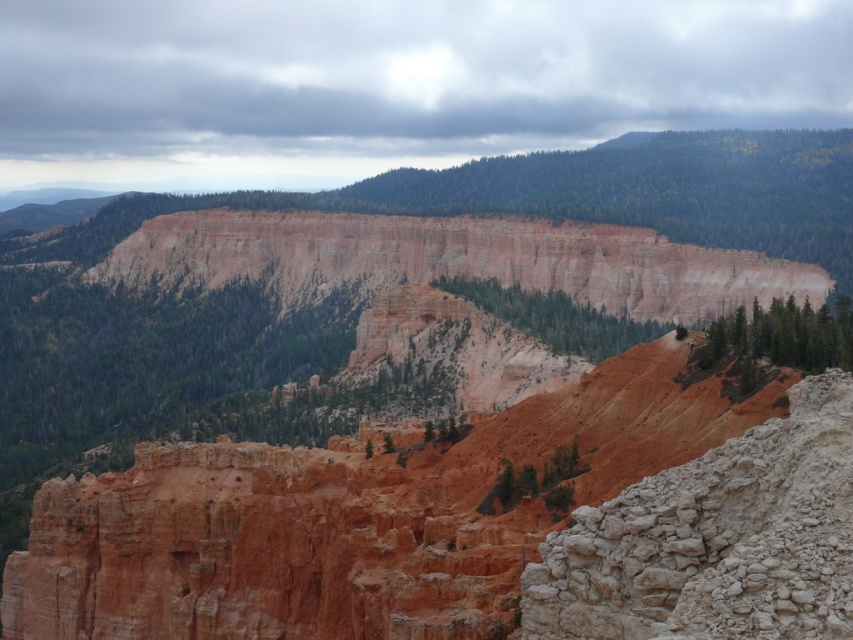
From the picture: Is white rough rock at center right to the right of green textured trees at center from the viewer's perspective?

No, white rough rock at center right is not to the right of green textured trees at center.

Looking at this image, does white rough rock at center right appear over green textured trees at center?

Actually, white rough rock at center right is below green textured trees at center.

Does point (711, 600) come in front of point (576, 301)?

Yes, it is.

The width and height of the screenshot is (853, 640). In order to click on white rough rock at center right in this screenshot , I will do `click(715, 540)`.

Is white rough rock at center right taller than green matte trees at right?

Yes, white rough rock at center right is taller than green matte trees at right.

Is white rough rock at center right to the left of green matte trees at right from the viewer's perspective?

Indeed, white rough rock at center right is positioned on the left side of green matte trees at right.

Is point (628, 531) closer to camera compared to point (788, 324)?

Yes, point (628, 531) is in front of point (788, 324).

The width and height of the screenshot is (853, 640). I want to click on white rough rock at center right, so click(x=715, y=540).

Is green textured trees at center further to camera compared to green matte trees at right?

Yes.

Which is behind, point (572, 333) or point (755, 336)?

Positioned behind is point (572, 333).

You are a GUI agent. You are given a task and a screenshot of the screen. Output one action in this format:
    pyautogui.click(x=<x>, y=<y>)
    Task: Click on the green textured trees at center
    
    Given the screenshot: What is the action you would take?
    pyautogui.click(x=555, y=317)